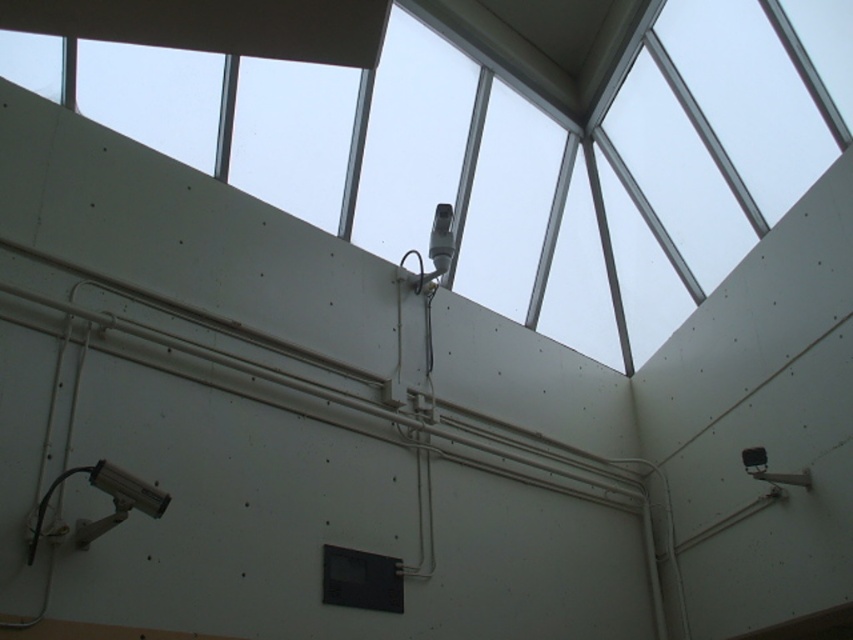
Question: Does transparent glass window at upper center come behind black matte window at center?

Choices:
 (A) no
 (B) yes

Answer: (B)

Question: Considering the relative positions of transparent glass window at upper center and black matte window at center in the image provided, where is transparent glass window at upper center located with respect to black matte window at center?

Choices:
 (A) right
 (B) left

Answer: (A)

Question: From the image, what is the correct spatial relationship of transparent glass window at upper center in relation to black matte window at center?

Choices:
 (A) above
 (B) below

Answer: (A)

Question: Among these points, which one is nearest to the camera?

Choices:
 (A) (518, 108)
 (B) (378, 570)

Answer: (B)